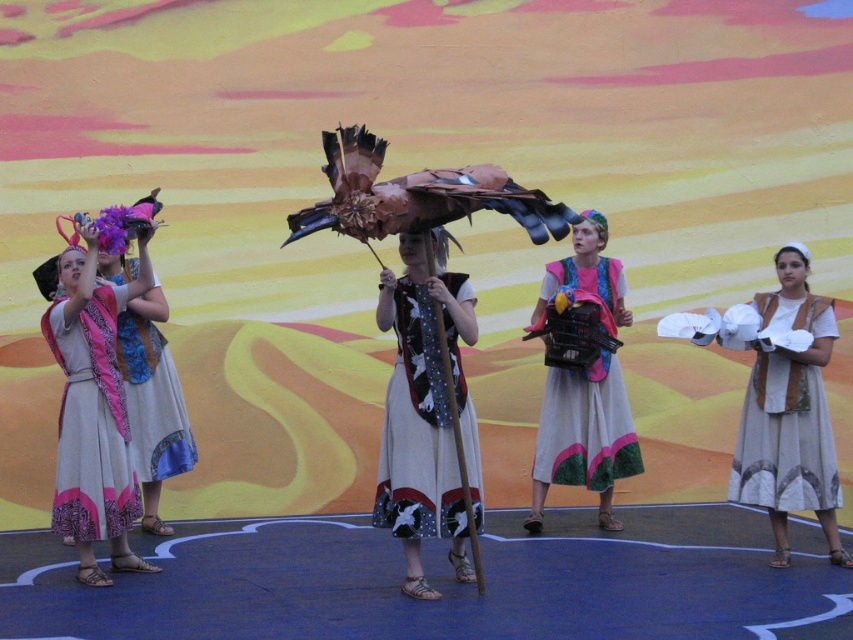
Can you confirm if white cotton dress at center is thinner than white cotton gloves at center?

Yes.

Who is positioned more to the right, white cotton dress at center or white cotton gloves at center?

white cotton gloves at center

Measure the distance between point [380,481] and camera.

Point [380,481] is 31.94 feet from camera.

What are the coordinates of `white cotton dress at center` in the screenshot? It's located at (425, 417).

Does white cotton dress at center come in front of matte blue fabric dress at left?

Yes, white cotton dress at center is in front of matte blue fabric dress at left.

Which is in front, point (412, 492) or point (146, 310)?

Point (412, 492) is more forward.

Locate an element on the screen. The width and height of the screenshot is (853, 640). white cotton dress at center is located at coordinates (425, 417).

Is matte pink scarf at left thinner than white cotton gloves at center?

No, matte pink scarf at left is not thinner than white cotton gloves at center.

Between point (128, 492) and point (738, 429), which one is positioned behind?

The point (738, 429) is behind.

Where is `matte pink scarf at left`? This screenshot has height=640, width=853. matte pink scarf at left is located at coordinates (91, 404).